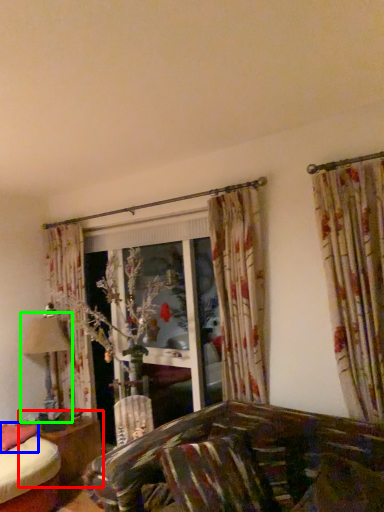
Question: Which is nearer to the table (highlighted by a red box)? pillow (highlighted by a blue box) or table lamp (highlighted by a green box).

Choices:
 (A) pillow
 (B) table lamp

Answer: (A)